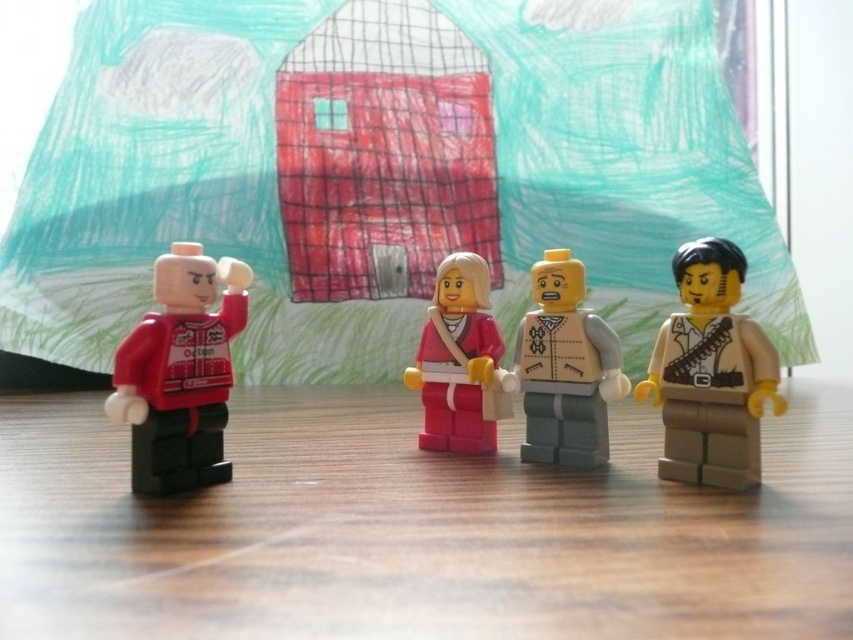
You are a toy organizer who needs to place a new toy that is 12 inches long between the wooden table at lower center and the matte red minifigure at left. Will there be enough space?

The wooden table at lower center and the matte red minifigure at left are 10.79 inches apart. Since the new toy is 12 inches long, which is longer than the available space, it won

You are a photographer setting up a shot of the wooden table at lower center and the light gray plastic minifigure at center. Based on their positions, which object should you place your camera to the left of to capture both in the frame?

You should place your camera to the left of the light gray plastic minifigure at center because the wooden table at lower center is to the left of it, so positioning the camera there would allow both objects to be in the frame.